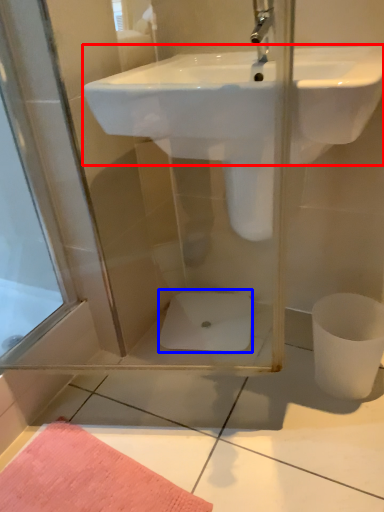
Question: Which point is closer to the camera, sink (highlighted by a red box) or toilet bowl (highlighted by a blue box)?

Choices:
 (A) sink
 (B) toilet bowl

Answer: (A)